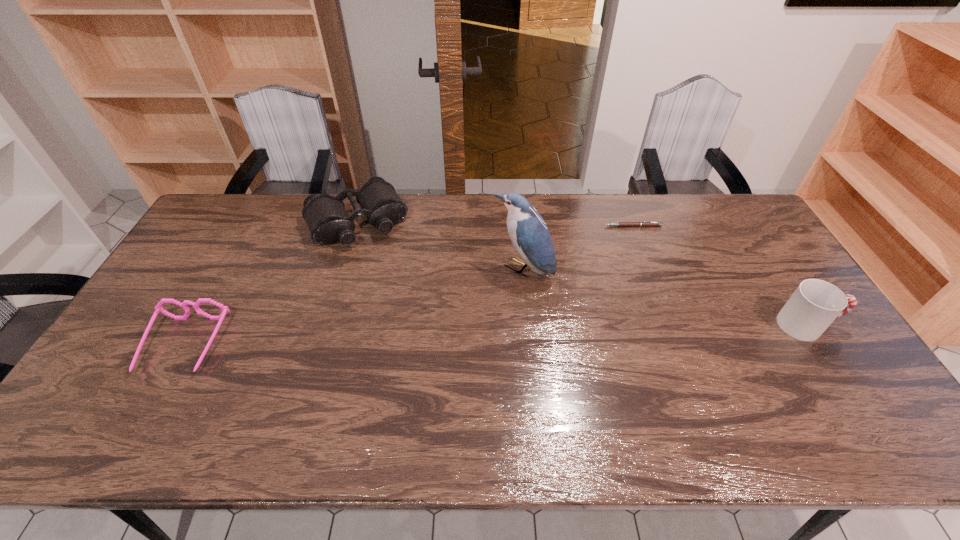
The height and width of the screenshot is (540, 960). I want to click on object present at the near edge, so click(x=158, y=307).

Find the location of `object that is at the left edge`. object that is at the left edge is located at coordinates (158, 307).

Find the location of a particular element. Image resolution: width=960 pixels, height=540 pixels. object that is at the right edge is located at coordinates (815, 304).

At what (x,y) coordinates should I click in order to perform the action: click on object at the near left corner. Please return your answer as a coordinate pair (x, y). Looking at the image, I should click on (158, 307).

In the image, there is a desktop. Identify the location of vacant space at the far edge. click(x=697, y=221).

In the image, there is a desktop. Where is `vacant space at the left edge`? Image resolution: width=960 pixels, height=540 pixels. vacant space at the left edge is located at coordinates tap(170, 366).

The width and height of the screenshot is (960, 540). I want to click on free location at the right edge, so click(x=749, y=280).

The height and width of the screenshot is (540, 960). I want to click on vacant space at the far left corner of the desktop, so click(x=226, y=213).

Where is `vacant space at the far right corner of the desktop`? vacant space at the far right corner of the desktop is located at coordinates (739, 218).

The width and height of the screenshot is (960, 540). What are the coordinates of `vacant space at the near right corner of the desktop` in the screenshot? It's located at (868, 392).